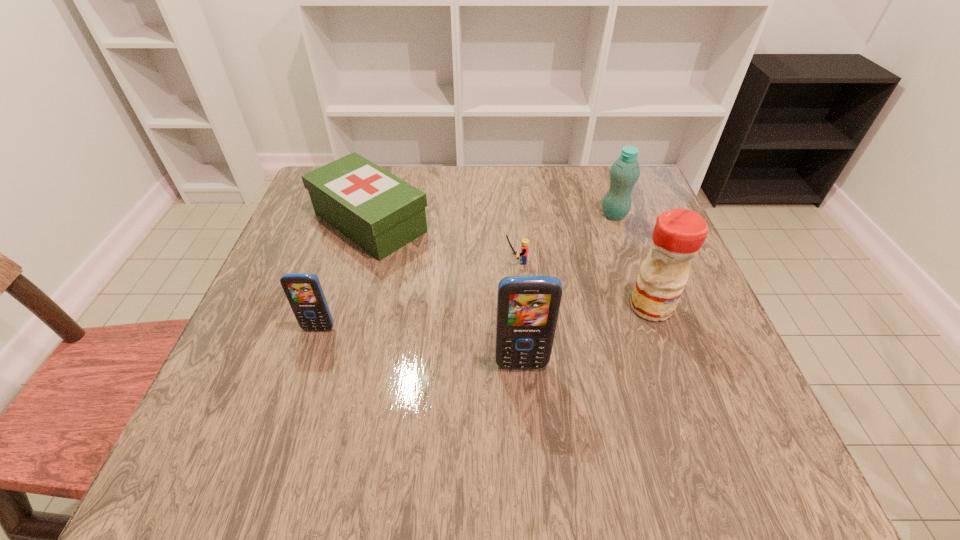
Find the location of a particular element. free area in between the first-aid kit and the nearer cellular telephone is located at coordinates (445, 293).

Point out which object is positioned as the third nearest to the fourth shortest object. Please provide its 2D coordinates. Your answer should be formatted as a tuple, i.e. [(x, y)], where the tuple contains the x and y coordinates of a point satisfying the conditions above.

[(380, 212)]

Locate an element on the screen. Image resolution: width=960 pixels, height=540 pixels. object that can be found as the fifth closest to the fourth tallest object is located at coordinates (625, 171).

You are a GUI agent. You are given a task and a screenshot of the screen. Output one action in this format:
    pyautogui.click(x=<x>, y=<y>)
    Task: Click on the free location that satisfies the following two spatial constraints: 1. at the front cap of the water bottle; 2. on the screen of the right cellular telephone
    Image resolution: width=960 pixels, height=540 pixels.
    Given the screenshot: What is the action you would take?
    pyautogui.click(x=667, y=365)

At what (x,y) coordinates should I click in order to perform the action: click on vacant area in the image that satisfies the following two spatial constraints: 1. at the front cap of the water bottle; 2. on the screen of the third shortest object. Please return your answer as a coordinate pair (x, y). This screenshot has width=960, height=540. Looking at the image, I should click on (655, 329).

You are a GUI agent. You are given a task and a screenshot of the screen. Output one action in this format:
    pyautogui.click(x=<x>, y=<y>)
    Task: Click on the free space in the image that satisfies the following two spatial constraints: 1. on the front-facing side of the condiment; 2. on the left side of the shortest object
    
    Given the screenshot: What is the action you would take?
    pyautogui.click(x=519, y=307)

Locate an element on the screen. vacant region that satisfies the following two spatial constraints: 1. at the front cap of the water bottle; 2. on the screen of the taller cellular telephone is located at coordinates (667, 365).

Where is `free space that satisfies the following two spatial constraints: 1. at the front cap of the third tallest object; 2. on the front side of the first-aid kit`? free space that satisfies the following two spatial constraints: 1. at the front cap of the third tallest object; 2. on the front side of the first-aid kit is located at coordinates (616, 222).